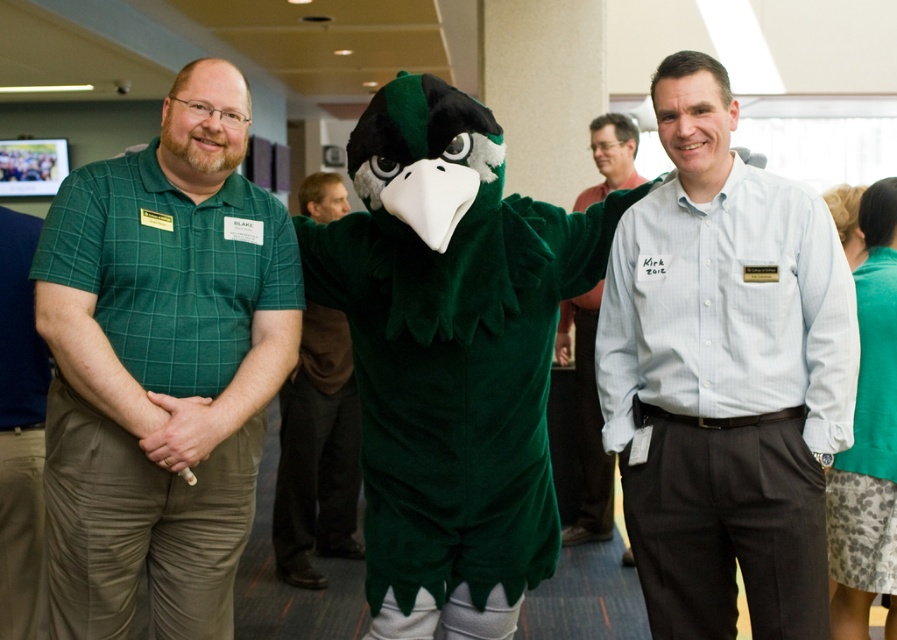
You are organizing a photo shoot in the conference room and need to ensure the green plush mascot at center and the light blue shirt at center are framed properly. Based on their sizes, which object should be placed closer to the camera to maintain proportional representation?

The light blue shirt at center should be placed closer to the camera because the green plush mascot at center is wider than the light blue shirt at center, so moving the smaller object forward helps balance their sizes in the frame.

You are a photographer setting up for a group photo in the conference room. You see the white shirt at center and the green plush mascot at center. Which one is positioned higher from the ground?

The white shirt at center is located above the green plush mascot at center, so the white shirt at center is positioned higher from the ground.

From the picture: You are a photographer standing in the conference room. You need to take a photo of the white shirt at center and the green plush mascot at center. The camera you are using has a minimum focus distance of 2 meters. Will you be able to capture both subjects clearly in the same photo without moving either of them?

The white shirt at center is 1.93 meters from the green plush mascot at center. Since the minimum focus distance required is 2 meters, the camera cannot focus on both subjects simultaneously as they are closer than the required distance. You will need to move either the subjects or the camera further apart to achieve clear focus on both.